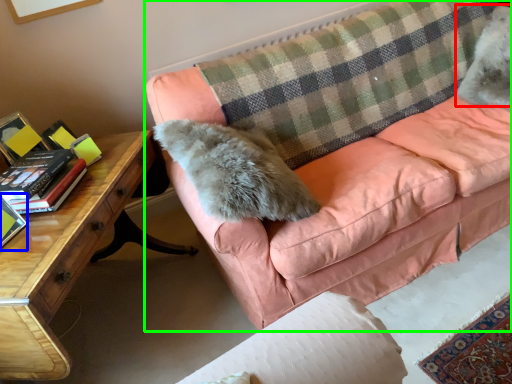
Question: Based on their relative distances, which object is nearer to animal (highlighted by a red box)? Choose from paperback book (highlighted by a blue box) and studio couch (highlighted by a green box).

Choices:
 (A) paperback book
 (B) studio couch

Answer: (B)